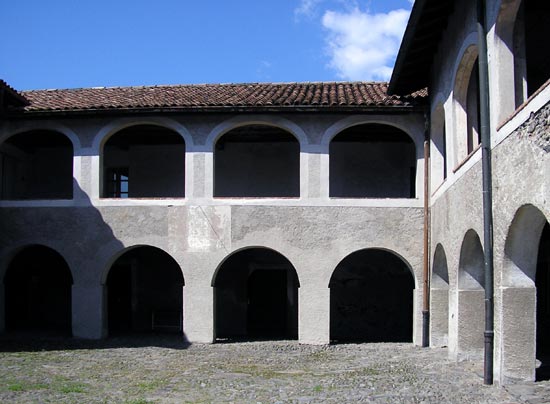
You are a GUI agent. You are given a task and a screenshot of the screen. Output one action in this format:
    pyautogui.click(x=<x>, y=<y>)
    Task: Click on the gray wall
    The width and height of the screenshot is (550, 404).
    Given the screenshot: What is the action you would take?
    pyautogui.click(x=502, y=205), pyautogui.click(x=474, y=204), pyautogui.click(x=110, y=229), pyautogui.click(x=317, y=242)